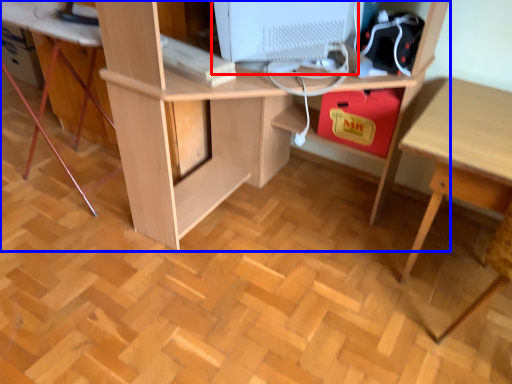
Question: Which of the following is the farthest to the observer, computer monitor (highlighted by a red box) or desk (highlighted by a blue box)?

Choices:
 (A) computer monitor
 (B) desk

Answer: (A)